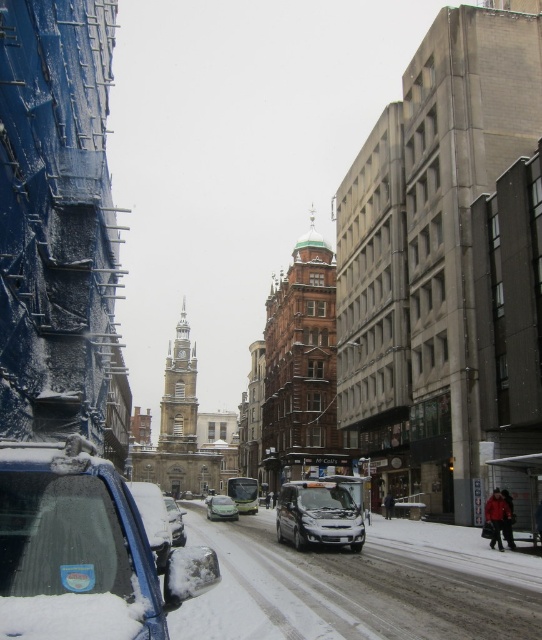
Question: Based on their relative distances, which object is farther from the snow-covered blue car at lower left?

Choices:
 (A) green matte car at center
 (B) shiny silver car at center

Answer: (B)

Question: Does satin black car at center have a greater width compared to silver metallic sedan at center?

Choices:
 (A) yes
 (B) no

Answer: (A)

Question: From the image, what is the correct spatial relationship of satin black car at center in relation to green matte car at center?

Choices:
 (A) left
 (B) right

Answer: (B)

Question: Is green matte car at center positioned in front of silver metallic sedan at center?

Choices:
 (A) no
 (B) yes

Answer: (A)

Question: Estimate the real-world distances between objects in this image. Which object is closer to the silver metallic sedan at center?

Choices:
 (A) shiny silver car at lower left
 (B) satin black car at center
 (C) green matte car at center
 (D) snow-covered blue car at lower left

Answer: (C)

Question: Which object is the closest to the shiny silver car at lower left?

Choices:
 (A) snow-covered blue car at lower left
 (B) green matte car at center
 (C) satin black car at center
 (D) shiny silver car at center

Answer: (A)